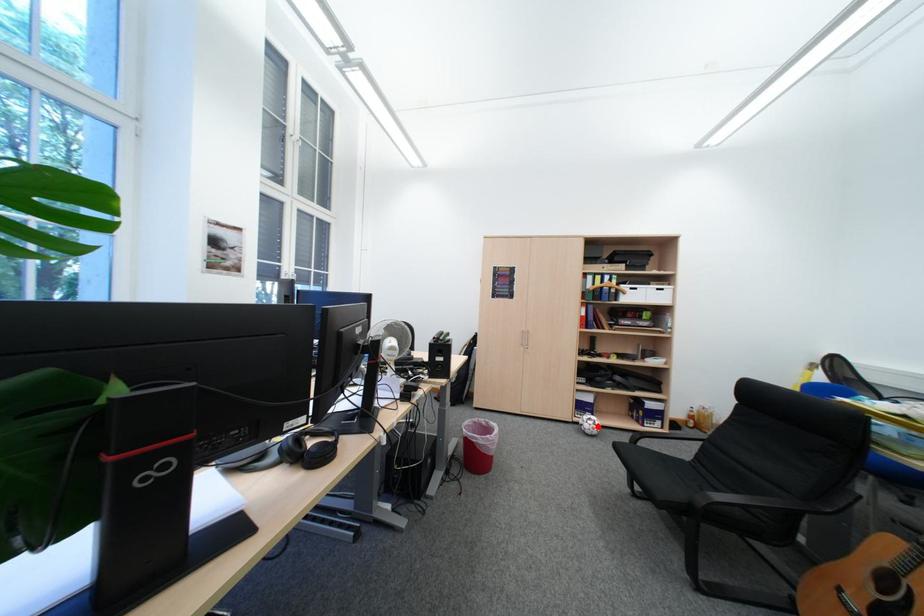
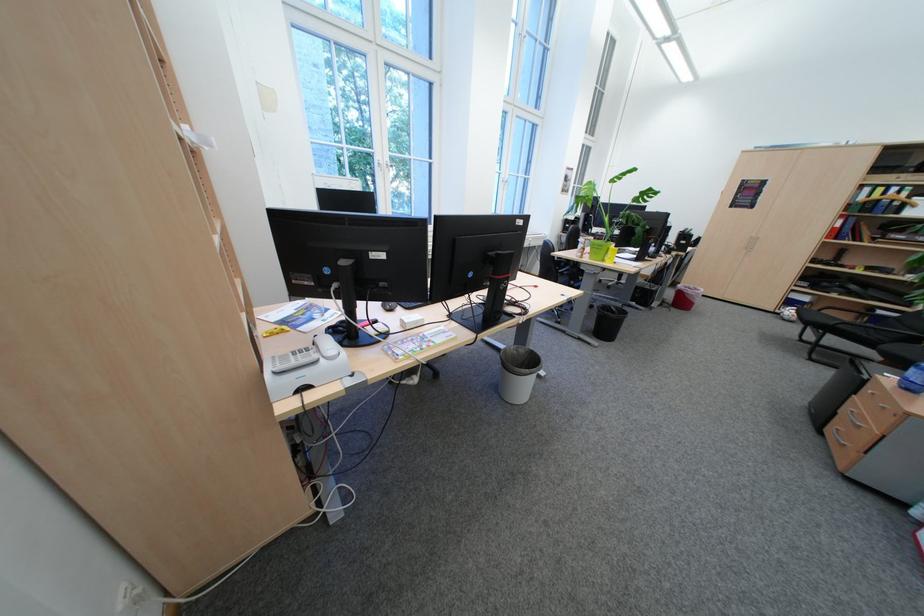
Question: I am providing you with two images of the same scene from different viewpoints. Given a red point in image1, look at the same physical point in image2. Is it:

Choices:
 (A) Closer to the viewpoint
 (B) Farther from the viewpoint

Answer: (B)